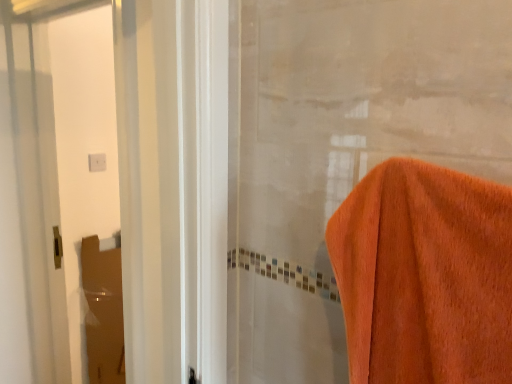
Question: Is brown cardboard at left, the 2th screen door in the front-to-back sequence, at the left side of clear glass screen door at left, acting as the 1th screen door starting from the front?

Choices:
 (A) no
 (B) yes

Answer: (B)

Question: Can you confirm if brown cardboard at left, the first screen door when ordered from back to front, is shorter than clear glass screen door at left, acting as the 1th screen door starting from the front?

Choices:
 (A) yes
 (B) no

Answer: (A)

Question: Is brown cardboard at left, the 2th screen door in the front-to-back sequence, thinner than clear glass screen door at left, acting as the 1th screen door starting from the front?

Choices:
 (A) no
 (B) yes

Answer: (B)

Question: From a real-world perspective, is brown cardboard at left, the first screen door when ordered from back to front, positioned over clear glass screen door at left, acting as the 1th screen door starting from the front, based on gravity?

Choices:
 (A) no
 (B) yes

Answer: (A)

Question: Is brown cardboard at left, the 2th screen door in the front-to-back sequence, next to clear glass screen door at left, acting as the 1th screen door starting from the front?

Choices:
 (A) no
 (B) yes

Answer: (A)

Question: From the image's perspective, does brown cardboard at left, the 2th screen door in the front-to-back sequence, appear lower than clear glass screen door at left, acting as the 1th screen door starting from the front?

Choices:
 (A) yes
 (B) no

Answer: (A)

Question: Is clear glass screen door at left, acting as the 1th screen door starting from the front, not within brown cardboard at left, the 2th screen door in the front-to-back sequence?

Choices:
 (A) yes
 (B) no

Answer: (A)

Question: Considering the relative sizes of clear glass screen door at left, the 2th screen door when ordered from back to front, and brown cardboard at left, the 2th screen door in the front-to-back sequence, in the image provided, is clear glass screen door at left, the 2th screen door when ordered from back to front, wider than brown cardboard at left, the 2th screen door in the front-to-back sequence,?

Choices:
 (A) no
 (B) yes

Answer: (B)

Question: From a real-world perspective, does clear glass screen door at left, acting as the 1th screen door starting from the front, stand above brown cardboard at left, the 2th screen door in the front-to-back sequence?

Choices:
 (A) no
 (B) yes

Answer: (B)

Question: Is clear glass screen door at left, acting as the 1th screen door starting from the front, closer to the viewer compared to brown cardboard at left, the first screen door when ordered from back to front?

Choices:
 (A) no
 (B) yes

Answer: (B)

Question: Is brown cardboard at left, the first screen door when ordered from back to front, located within clear glass screen door at left, the 2th screen door when ordered from back to front?

Choices:
 (A) no
 (B) yes

Answer: (A)

Question: Is clear glass screen door at left, acting as the 1th screen door starting from the front, positioned with its back to brown cardboard at left, the first screen door when ordered from back to front?

Choices:
 (A) no
 (B) yes

Answer: (B)

Question: Do you think brown cardboard at left, the 2th screen door in the front-to-back sequence, is within clear glass screen door at left, the 2th screen door when ordered from back to front, or outside of it?

Choices:
 (A) inside
 (B) outside

Answer: (B)